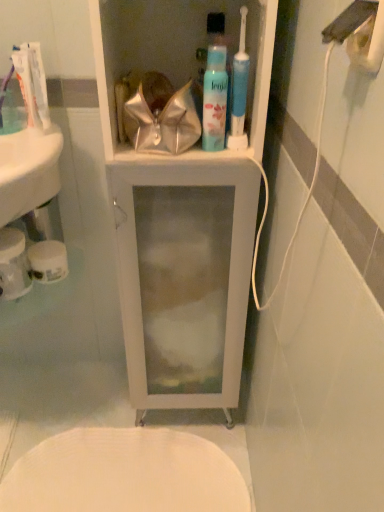
Question: Is translucent plastic toothpaste at upper left, marked as the first toothpaste in a front-to-back arrangement, surrounded by white textured toilet at lower center?

Choices:
 (A) yes
 (B) no

Answer: (B)

Question: Can you confirm if white textured toilet at lower center is positioned to the right of translucent plastic toothpaste at upper left, which appears as the 2th toothpaste when viewed from the back?

Choices:
 (A) no
 (B) yes

Answer: (B)

Question: From the image's perspective, is white textured toilet at lower center above translucent plastic toothpaste at upper left, which appears as the 2th toothpaste when viewed from the back?

Choices:
 (A) no
 (B) yes

Answer: (A)

Question: Considering the relative sizes of white textured toilet at lower center and translucent plastic toothpaste at upper left, marked as the first toothpaste in a front-to-back arrangement, in the image provided, is white textured toilet at lower center shorter than translucent plastic toothpaste at upper left, marked as the first toothpaste in a front-to-back arrangement,?

Choices:
 (A) no
 (B) yes

Answer: (B)

Question: Is white textured toilet at lower center facing towards translucent plastic toothpaste at upper left, marked as the first toothpaste in a front-to-back arrangement?

Choices:
 (A) no
 (B) yes

Answer: (A)

Question: Is white glossy toothpaste at upper left, placed as the 2th toothpaste when sorted from front to back, bigger or smaller than white textured toilet at lower center?

Choices:
 (A) big
 (B) small

Answer: (B)

Question: From their relative heights in the image, would you say white glossy toothpaste at upper left, placed as the 2th toothpaste when sorted from front to back, is taller or shorter than white textured toilet at lower center?

Choices:
 (A) tall
 (B) short

Answer: (A)

Question: Is point (26, 46) closer or farther from the camera than point (92, 433)?

Choices:
 (A) farther
 (B) closer

Answer: (B)

Question: From a real-world perspective, is white glossy toothpaste at upper left, which appears as the 1th toothpaste when viewed from the back, physically located above or below white textured toilet at lower center?

Choices:
 (A) above
 (B) below

Answer: (A)

Question: In terms of width, does white glossy sink at left look wider or thinner when compared to white glossy toothpaste at upper left, placed as the 2th toothpaste when sorted from front to back?

Choices:
 (A) wide
 (B) thin

Answer: (A)

Question: From a real-world perspective, is white glossy sink at left above or below white glossy toothpaste at upper left, which appears as the 1th toothpaste when viewed from the back?

Choices:
 (A) above
 (B) below

Answer: (B)

Question: Is point (26, 193) positioned closer to the camera than point (39, 55)?

Choices:
 (A) closer
 (B) farther

Answer: (A)

Question: Would you say white glossy sink at left is inside or outside white glossy toothpaste at upper left, placed as the 2th toothpaste when sorted from front to back?

Choices:
 (A) inside
 (B) outside

Answer: (B)

Question: Visually, is translucent plastic mouthwash at upper center positioned to the left or to the right of white matte toilet paper at lower left, which appears as the 2th toilet paper when viewed from the left?

Choices:
 (A) left
 (B) right

Answer: (B)

Question: Is translucent plastic mouthwash at upper center in front of or behind white matte toilet paper at lower left, which appears as the 2th toilet paper when viewed from the left, in the image?

Choices:
 (A) front
 (B) behind

Answer: (A)